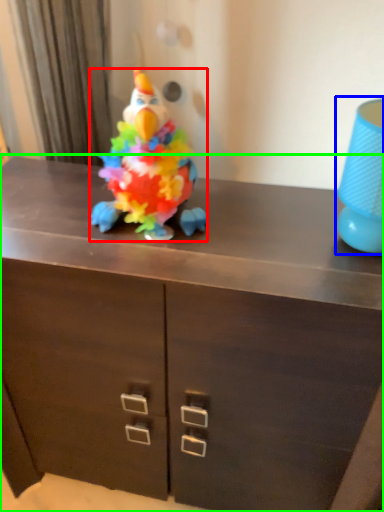
Question: Considering the real-world distances, which object is closest to toy (highlighted by a red box)? lamp (highlighted by a blue box) or chest of drawers (highlighted by a green box).

Choices:
 (A) lamp
 (B) chest of drawers

Answer: (B)